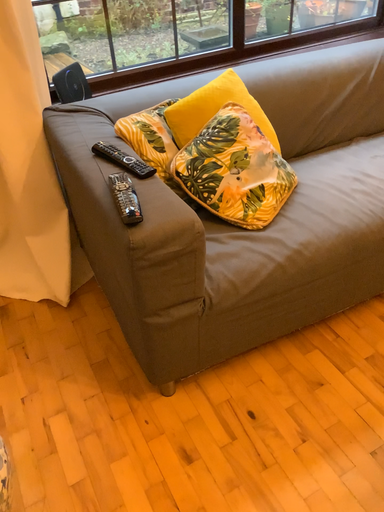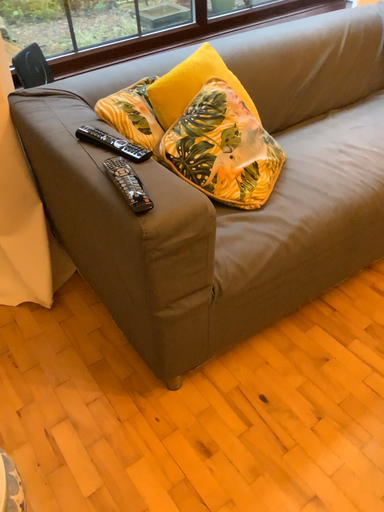
Question: Which way did the camera rotate in the video?

Choices:
 (A) rotated left
 (B) rotated right

Answer: (B)